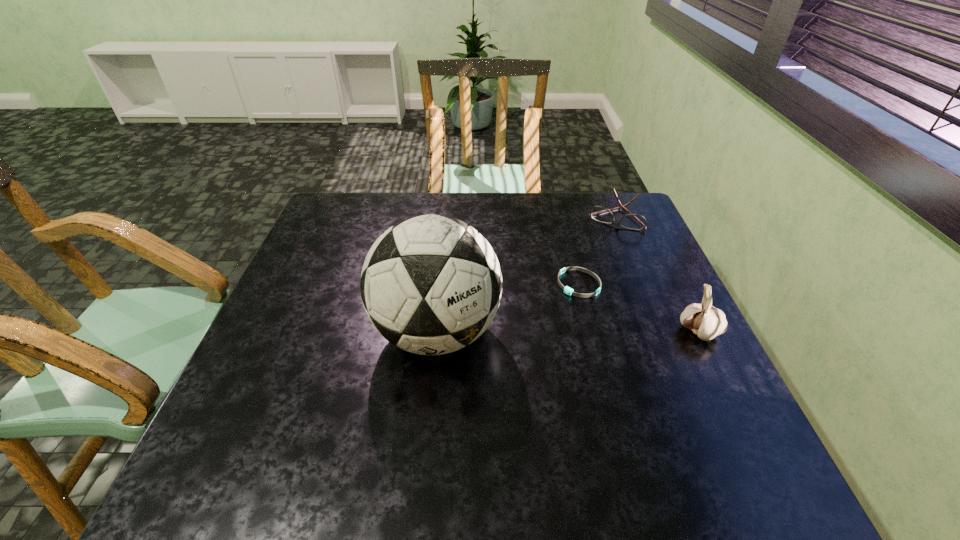
Locate an element on the screen. The height and width of the screenshot is (540, 960). free space on the desktop that is between the tallest object and the second tallest object and is positioned on the front-facing side of the second shortest object is located at coordinates (563, 332).

The width and height of the screenshot is (960, 540). Identify the location of free spot on the desktop that is between the tallest object and the third shortest object and is positioned on the buckle of the wristband. (540, 332).